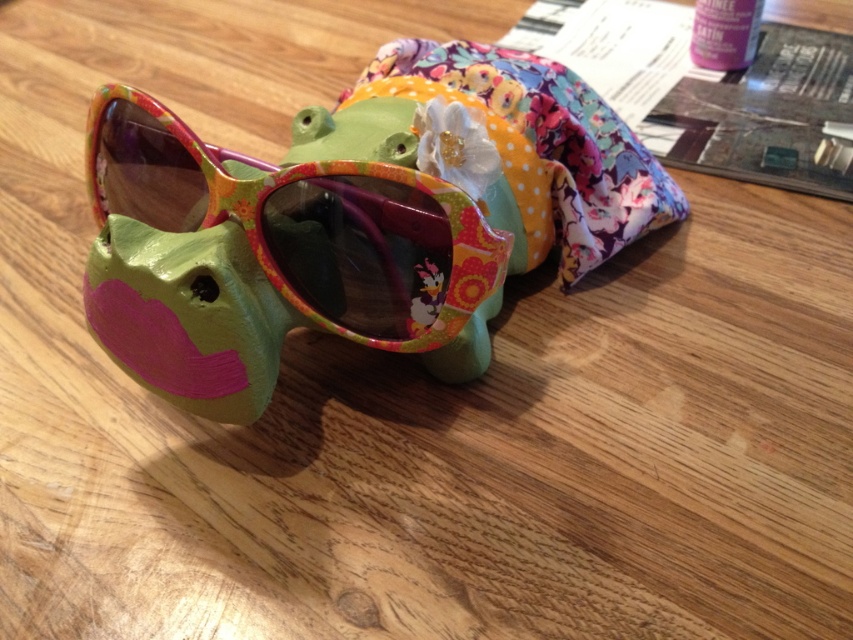
Who is lower down, matte plastic goggles at center or floral fabric pouch at center?

matte plastic goggles at center is lower down.

Is point (438, 259) in front of point (606, 216)?

Yes.

Who is more distant from viewer, (126, 112) or (450, 52)?

Point (450, 52)

This screenshot has height=640, width=853. What are the coordinates of `matte plastic goggles at center` in the screenshot? It's located at (306, 224).